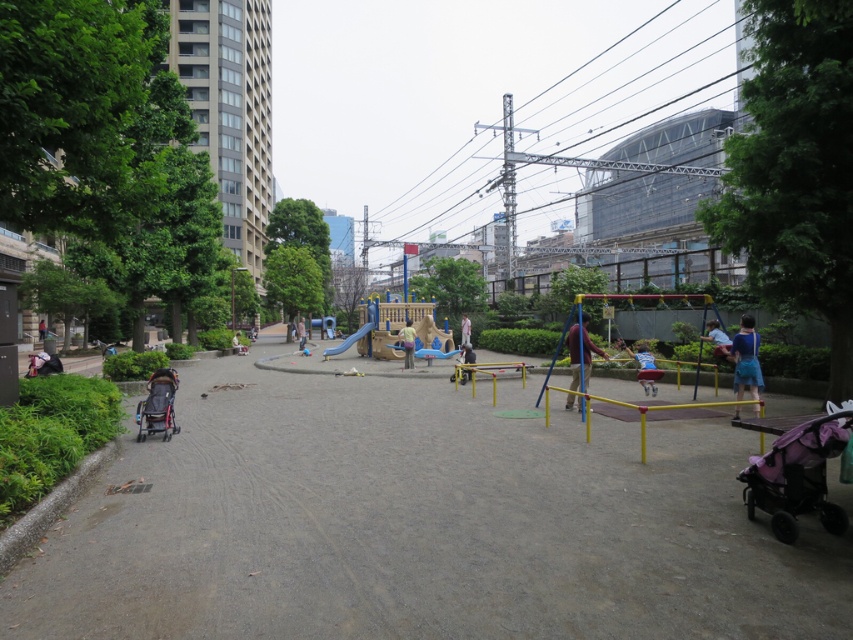
You are a parent pushing your child on the blue fabric swing at right. You want to walk back to the smooth concrete path at center after the swing stops. Is the path wide enough for you to walk comfortably?

The smooth concrete path at center is wider than the blue fabric swing at right, so yes, the path is wide enough for you to walk comfortably.

You are a parent pushing your child on the blue fabric swing at right and want to walk to the smooth concrete path at center. Which direction should you move to reach it?

The smooth concrete path at center is positioned on the left side of the blue fabric swing at right, so you should move to the left to reach it.

In the scene shown: You are standing at the center of the playground and see the point at coordinates (798, 476). Which object is this point located on?

The point at coordinates (798, 476) is located on the matte purple stroller at lower right.